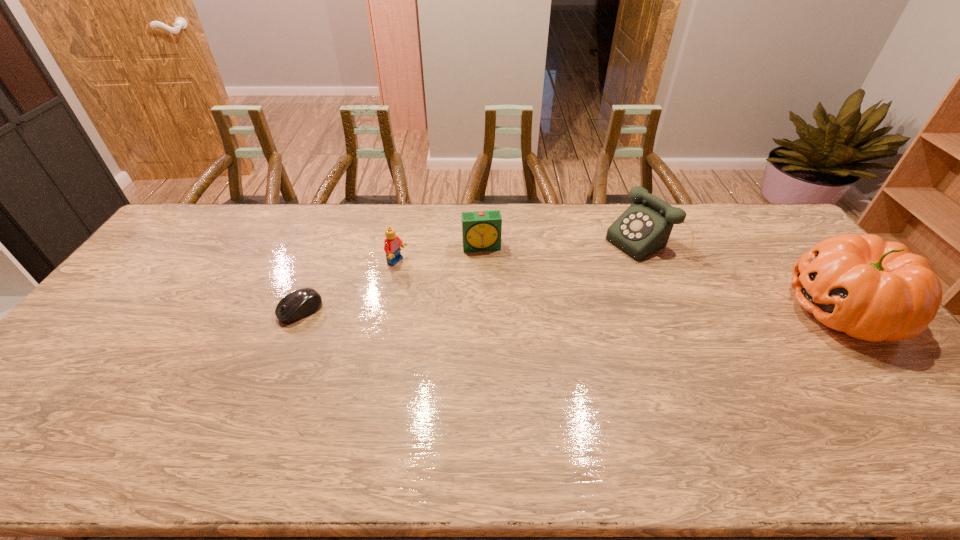
Identify which object is the third nearest to the tallest object. Please provide its 2D coordinates. Your answer should be formatted as a tuple, i.e. [(x, y)], where the tuple contains the x and y coordinates of a point satisfying the conditions above.

[(392, 244)]

Identify the location of free space that satisfies the following two spatial constraints: 1. on the front side of the rightmost object; 2. on the carved face of the fourth shortest object. The height and width of the screenshot is (540, 960). (679, 310).

What are the coordinates of `vacant area that satisfies the following two spatial constraints: 1. on the back side of the shortest object; 2. on the right side of the second tallest object` in the screenshot? It's located at (327, 244).

Find the location of `free region that satisfies the following two spatial constraints: 1. on the front side of the fourth object from right to left; 2. on the carved face of the pumpkin`. free region that satisfies the following two spatial constraints: 1. on the front side of the fourth object from right to left; 2. on the carved face of the pumpkin is located at coordinates (388, 310).

This screenshot has height=540, width=960. Find the location of `free space that satisfies the following two spatial constraints: 1. on the back side of the fourth object from left to right; 2. on the right side of the mouse`. free space that satisfies the following two spatial constraints: 1. on the back side of the fourth object from left to right; 2. on the right side of the mouse is located at coordinates (327, 244).

The image size is (960, 540). I want to click on free space that satisfies the following two spatial constraints: 1. on the back side of the alarm clock; 2. on the left side of the fourth shortest object, so click(482, 244).

Where is `free space that satisfies the following two spatial constraints: 1. on the back side of the mouse; 2. on the left side of the third object from left to right`? The image size is (960, 540). free space that satisfies the following two spatial constraints: 1. on the back side of the mouse; 2. on the left side of the third object from left to right is located at coordinates (326, 246).

What are the coordinates of `blank space that satisfies the following two spatial constraints: 1. on the front side of the second object from left to right; 2. on the carved face of the pumpkin` in the screenshot? It's located at (388, 310).